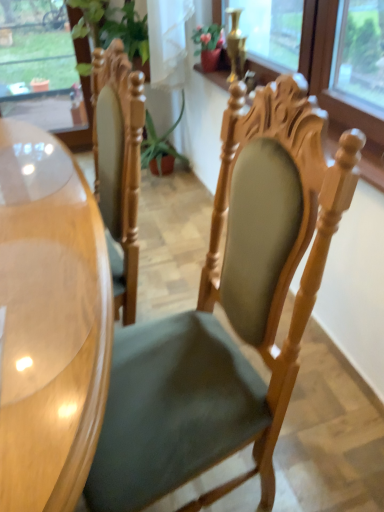
Question: From the image's perspective, does transparent glass window at upper left appear lower than glossy wood desk at left?

Choices:
 (A) yes
 (B) no

Answer: (B)

Question: From a real-world perspective, does transparent glass window at upper left stand above glossy wood desk at left?

Choices:
 (A) yes
 (B) no

Answer: (A)

Question: Are transparent glass window at upper left and glossy wood desk at left located far from each other?

Choices:
 (A) yes
 (B) no

Answer: (A)

Question: Does transparent glass window at upper left have a lesser height compared to glossy wood desk at left?

Choices:
 (A) no
 (B) yes

Answer: (A)

Question: Does transparent glass window at upper left have a greater width compared to glossy wood desk at left?

Choices:
 (A) no
 (B) yes

Answer: (A)

Question: Is transparent glass window at upper left surrounding glossy wood desk at left?

Choices:
 (A) yes
 (B) no

Answer: (B)

Question: Is glossy wood desk at left at the right side of transparent glass window at upper left?

Choices:
 (A) no
 (B) yes

Answer: (B)

Question: From a real-world perspective, is glossy wood desk at left below transparent glass window at upper left?

Choices:
 (A) yes
 (B) no

Answer: (A)

Question: Would you say transparent glass window at upper left is part of glossy wood desk at left's contents?

Choices:
 (A) no
 (B) yes

Answer: (A)

Question: Can you confirm if glossy wood desk at left is bigger than transparent glass window at upper left?

Choices:
 (A) no
 (B) yes

Answer: (B)

Question: Is glossy wood desk at left positioned before transparent glass window at upper left?

Choices:
 (A) no
 (B) yes

Answer: (B)

Question: From the image's perspective, does glossy wood desk at left appear higher than transparent glass window at upper left?

Choices:
 (A) yes
 (B) no

Answer: (B)

Question: Is green fabric chair at center a part of transparent glass window at upper left?

Choices:
 (A) no
 (B) yes

Answer: (A)